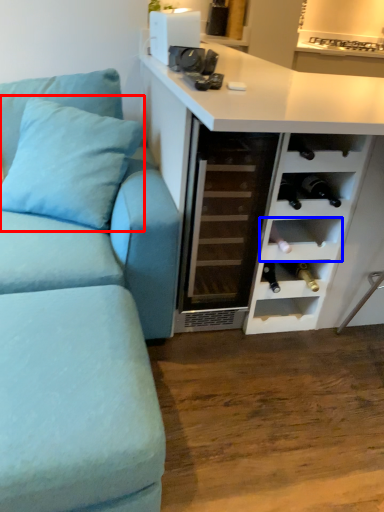
Question: Which point is further to the camera, pillow (highlighted by a red box) or shelf (highlighted by a blue box)?

Choices:
 (A) pillow
 (B) shelf

Answer: (B)